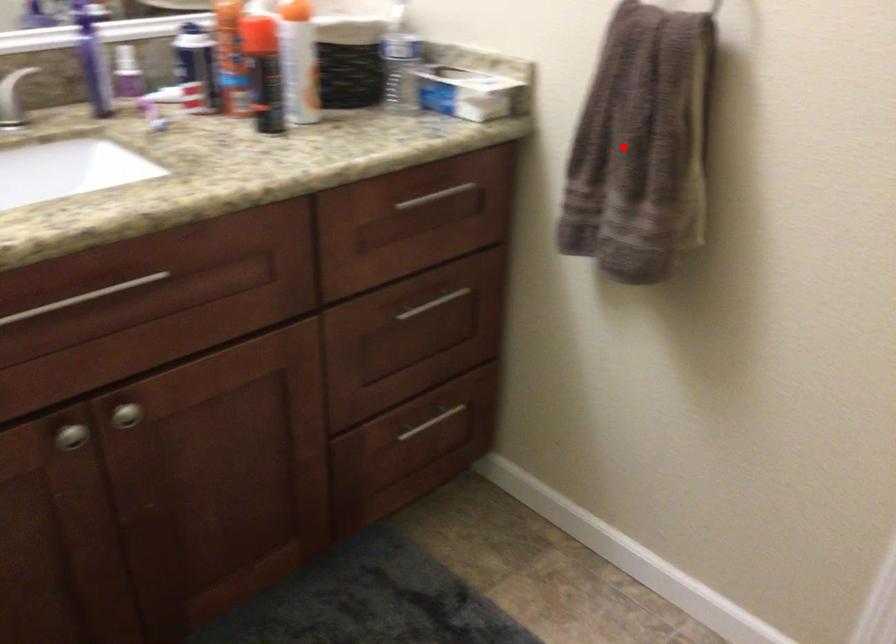
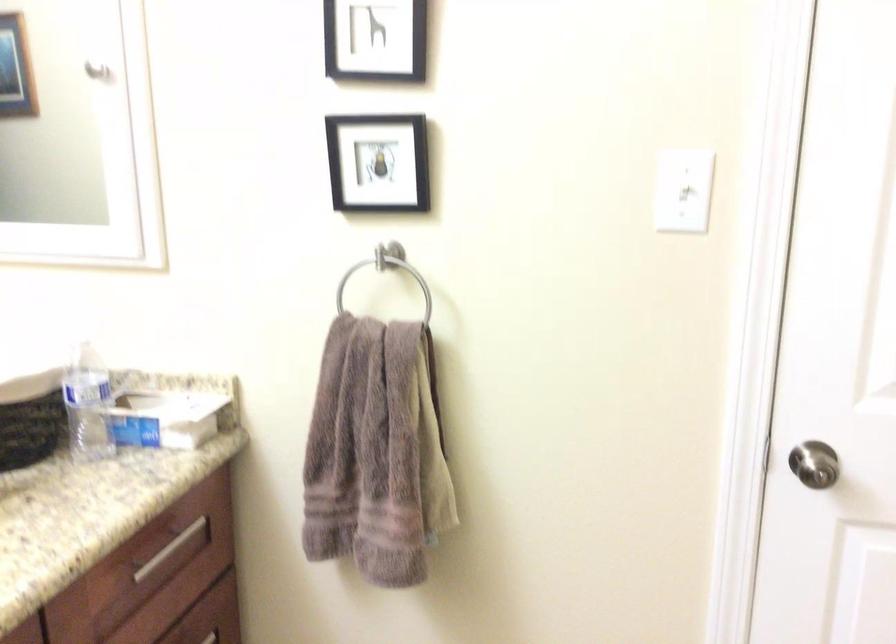
Find the pixel in the second image that matches the highlighted location in the first image.

(375, 453)